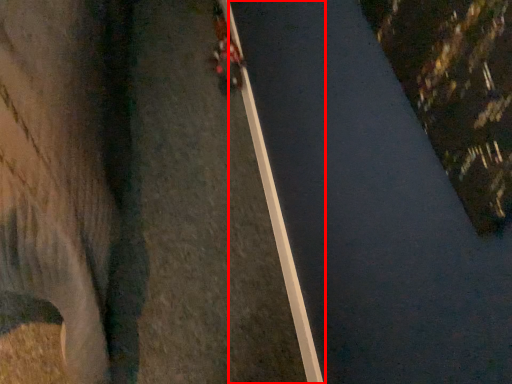
Question: From the image's perspective, considering the relative positions of curb (annotated by the red box) and vehicle in the image provided, where is curb (annotated by the red box) located with respect to the staircase?

Choices:
 (A) below
 (B) above

Answer: (A)